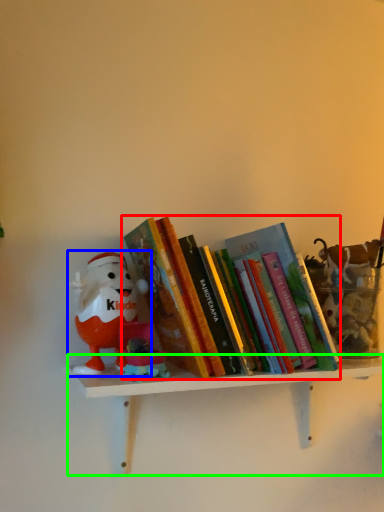
Question: Based on their relative distances, which object is nearer to book (highlighted by a red box)? Choose from toy (highlighted by a blue box) and shelf (highlighted by a green box).

Choices:
 (A) toy
 (B) shelf

Answer: (A)